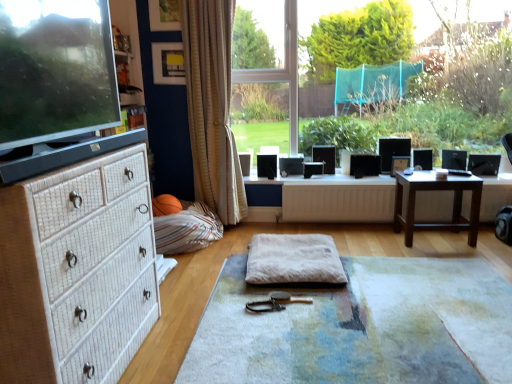
The image size is (512, 384). Describe the element at coordinates (437, 190) in the screenshot. I see `brown wooden table at right` at that location.

Locate an element on the screen. striped fabric bean bag at lower left is located at coordinates (187, 229).

This screenshot has height=384, width=512. Describe the element at coordinates (212, 107) in the screenshot. I see `beige striped curtain at center` at that location.

Find the location of a particular element. The height and width of the screenshot is (384, 512). white textured radiator at center is located at coordinates (338, 203).

What is the approximate width of white textured radiator at center?

The width of white textured radiator at center is 3.13 inches.

In order to face white wicker chest of drawers at left, should I rotate leftwards or rightwards?

To align with it, rotate left about 25.001°.

At what (x,y) coordinates should I click in order to perform the action: click on transparent glass window at center. Please return your answer as a coordinate pair (x, y). This screenshot has height=384, width=512. Looking at the image, I should click on (406, 72).

Image resolution: width=512 pixels, height=384 pixels. In order to click on matte wooden picture frame at upper center in this screenshot , I will do `click(168, 63)`.

I want to click on brown wooden table at right, so click(x=437, y=190).

What are the coordinates of `chest of drawers in front of the beige striped curtain at center` in the screenshot? It's located at (77, 271).

Measure the distance from beige striped curtain at center to white wicker chest of drawers at left.

beige striped curtain at center is 5.41 feet from white wicker chest of drawers at left.

Is beige striped curtain at center taller than white wicker chest of drawers at left?

Indeed, beige striped curtain at center has a greater height compared to white wicker chest of drawers at left.

Considering the sizes of objects beige striped curtain at center and white wicker chest of drawers at left in the image provided, who is thinner, beige striped curtain at center or white wicker chest of drawers at left?

beige striped curtain at center.

Is the depth of striped fabric bean bag at lower left less than that of white wicker chest of drawers at left?

No, it is not.

Is striped fabric bean bag at lower left far away from white wicker chest of drawers at left?

Indeed, striped fabric bean bag at lower left is not near white wicker chest of drawers at left.

Is white wicker chest of drawers at left a part of striped fabric bean bag at lower left?

Actually, white wicker chest of drawers at left is outside striped fabric bean bag at lower left.

Which object is positioned more to the left, striped fabric bean bag at lower left or white wicker chest of drawers at left?

white wicker chest of drawers at left is more to the left.

From a real-world perspective, is beige textured yoga mat at center, the 2th yoga mat when ordered from top to bottom, physically located above or below matte black monitor at left?

beige textured yoga mat at center, the 2th yoga mat when ordered from top to bottom, is below matte black monitor at left.

Is matte black monitor at left inside beige textured yoga mat at center, the 2th yoga mat when ordered from top to bottom?

Definitely not — matte black monitor at left is not inside beige textured yoga mat at center, the 2th yoga mat when ordered from top to bottom.

How many degrees apart are the facing directions of beige textured yoga mat at center, the 2th yoga mat when ordered from top to bottom, and matte black monitor at left?

The angle between the facing direction of beige textured yoga mat at center, the 2th yoga mat when ordered from top to bottom, and the facing direction of matte black monitor at left is 178 degrees.

Is transparent glass window at center not close to beige striped curtain at center?

Yes, transparent glass window at center and beige striped curtain at center are located far from each other.

Is transparent glass window at center looking in the opposite direction of beige striped curtain at center?

No, transparent glass window at center is not facing the opposite direction of beige striped curtain at center.

Does transparent glass window at center come behind beige striped curtain at center?

Yes.

Where is `the 1st yoga mat behind the white wicker chest of drawers at left, counting from the anchor's position`? The image size is (512, 384). the 1st yoga mat behind the white wicker chest of drawers at left, counting from the anchor's position is located at coordinates (361, 327).

From a real-world perspective, between white wicker chest of drawers at left and beige textured yoga mat at center, the 2th yoga mat when ordered from top to bottom, who is vertically lower?

beige textured yoga mat at center, the 2th yoga mat when ordered from top to bottom, is physically lower.

Is brown wooden table at right far away from white fluffy yoga mat at center, placed as the second yoga mat when sorted from bottom to top?

brown wooden table at right is actually quite close to white fluffy yoga mat at center, placed as the second yoga mat when sorted from bottom to top.

How different are the orientations of brown wooden table at right and white fluffy yoga mat at center, marked as the first yoga mat in a top-to-bottom arrangement, in degrees?

There is a 3.03-degree angle between the facing directions of brown wooden table at right and white fluffy yoga mat at center, marked as the first yoga mat in a top-to-bottom arrangement.

From the image's perspective, would you say brown wooden table at right is positioned over white fluffy yoga mat at center, marked as the first yoga mat in a top-to-bottom arrangement?

Yes, from the image's perspective, brown wooden table at right is over white fluffy yoga mat at center, marked as the first yoga mat in a top-to-bottom arrangement.

Between point (410, 174) and point (283, 279), which one is positioned behind?

The point (410, 174) is farther from the camera.

From the picture: Is matte wooden picture frame at upper center facing towards white fluffy yoga mat at center, placed as the second yoga mat when sorted from bottom to top?

Answer: No, matte wooden picture frame at upper center is not facing towards white fluffy yoga mat at center, placed as the second yoga mat when sorted from bottom to top.

Identify the location of yoga mat that is the 1st object located below the matte wooden picture frame at upper center (from the image's perspective). (294, 259).

Which is more to the right, matte wooden picture frame at upper center or white fluffy yoga mat at center, marked as the first yoga mat in a top-to-bottom arrangement?

From the viewer's perspective, white fluffy yoga mat at center, marked as the first yoga mat in a top-to-bottom arrangement, appears more on the right side.

Can you tell me how much matte wooden picture frame at upper center and white fluffy yoga mat at center, placed as the second yoga mat when sorted from bottom to top, differ in facing direction?

They differ by 6.46 degrees in their facing directions.

Where is `curtain that is on the right side of white wicker chest of drawers at left`? The width and height of the screenshot is (512, 384). curtain that is on the right side of white wicker chest of drawers at left is located at coordinates (212, 107).

Where is `bean bag chair above the white wicker chest of drawers at left (from the image's perspective)`? The image size is (512, 384). bean bag chair above the white wicker chest of drawers at left (from the image's perspective) is located at coordinates (187, 229).

From the image, which object appears to be farther from transparent glass window at center, matte wooden picture frame at upper center or white fluffy yoga mat at center, placed as the second yoga mat when sorted from bottom to top?

white fluffy yoga mat at center, placed as the second yoga mat when sorted from bottom to top, is further to transparent glass window at center.

Estimate the real-world distances between objects in this image. Which object is further from brown wooden table at right, white fluffy yoga mat at center, marked as the first yoga mat in a top-to-bottom arrangement, or beige textured yoga mat at center, the 1th yoga mat in the bottom-to-top sequence?

beige textured yoga mat at center, the 1th yoga mat in the bottom-to-top sequence, is further to brown wooden table at right.

Estimate the real-world distances between objects in this image. Which object is further from striped fabric bean bag at lower left, white textured radiator at center or matte black monitor at left?

matte black monitor at left is positioned further to the anchor striped fabric bean bag at lower left.

Based on their spatial positions, is matte black monitor at left or beige textured yoga mat at center, the 1th yoga mat in the bottom-to-top sequence, closer to transparent glass window at center?

beige textured yoga mat at center, the 1th yoga mat in the bottom-to-top sequence, is closer to transparent glass window at center.

Estimate the real-world distances between objects in this image. Which object is further from white textured radiator at center, matte black monitor at left or striped fabric bean bag at lower left?

matte black monitor at left is further to white textured radiator at center.

Estimate the real-world distances between objects in this image. Which object is closer to matte black monitor at left, transparent glass window at center or white fluffy yoga mat at center, marked as the first yoga mat in a top-to-bottom arrangement?

white fluffy yoga mat at center, marked as the first yoga mat in a top-to-bottom arrangement, lies closer to matte black monitor at left than the other object.

Based on their spatial positions, is white textured radiator at center or brown wooden table at right further from matte wooden picture frame at upper center?

Based on the image, brown wooden table at right appears to be further to matte wooden picture frame at upper center.

Based on their spatial positions, is white fluffy yoga mat at center, marked as the first yoga mat in a top-to-bottom arrangement, or beige striped curtain at center further from matte black monitor at left?

Based on the image, beige striped curtain at center appears to be further to matte black monitor at left.

The width and height of the screenshot is (512, 384). Identify the location of yoga mat between transparent glass window at center and beige textured yoga mat at center, the 2th yoga mat when ordered from top to bottom, from top to bottom. (294, 259).

You are a GUI agent. You are given a task and a screenshot of the screen. Output one action in this format:
    pyautogui.click(x=<x>, y=<y>)
    Task: Click on the curtain between matte black monitor at left and matte wooden picture frame at upper center along the z-axis
    This screenshot has width=512, height=384.
    Given the screenshot: What is the action you would take?
    pyautogui.click(x=212, y=107)

I want to click on picture frame between beige textured yoga mat at center, the 2th yoga mat when ordered from top to bottom, and white textured radiator at center from front to back, so click(168, 63).

The height and width of the screenshot is (384, 512). In order to click on curtain situated between matte wooden picture frame at upper center and brown wooden table at right from left to right in this screenshot , I will do `click(212, 107)`.